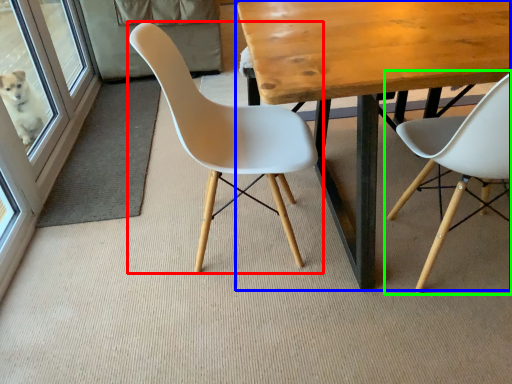
Question: Based on their relative distances, which object is farther from chair (highlighted by a red box)? Choose from table (highlighted by a blue box) and chair (highlighted by a green box).

Choices:
 (A) table
 (B) chair

Answer: (B)